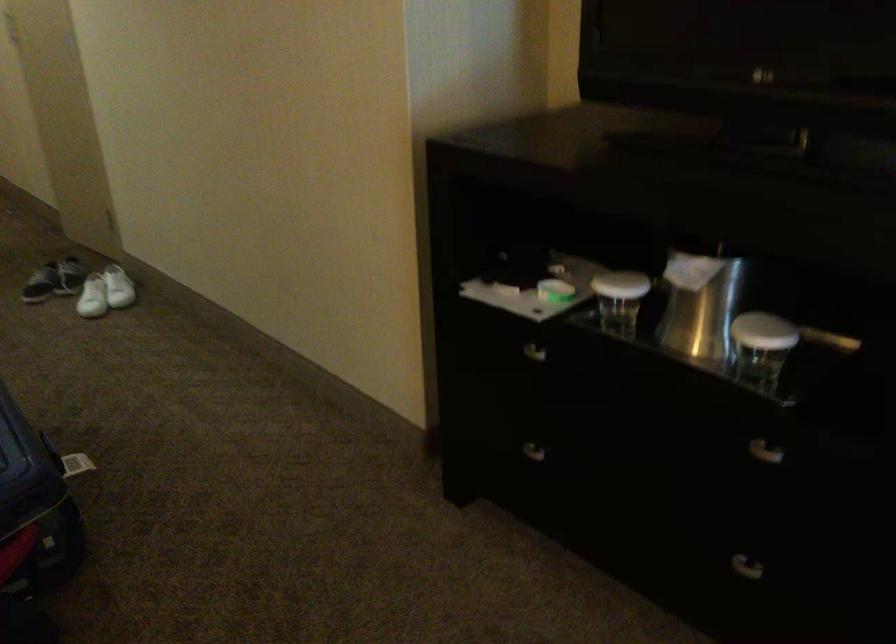
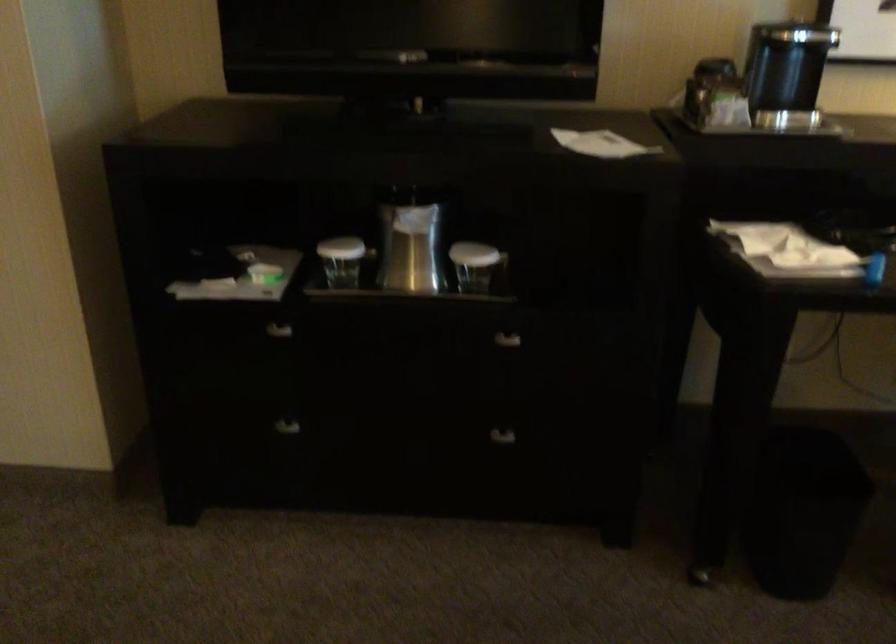
Find the pixel in the second image that matches (x=541, y=348) in the first image.

(271, 327)